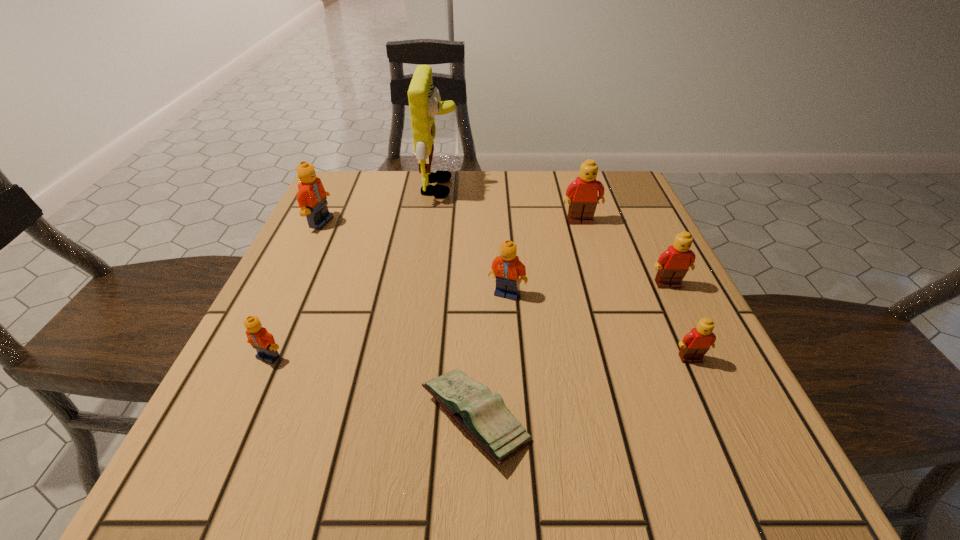
Where is `sponge positioned at the far edge`? The width and height of the screenshot is (960, 540). sponge positioned at the far edge is located at coordinates (425, 102).

The height and width of the screenshot is (540, 960). I want to click on object located at the near edge, so click(484, 416).

Find the location of `object at the far left corner`. object at the far left corner is located at coordinates (311, 197).

This screenshot has height=540, width=960. Find the location of `object at the far right corner`. object at the far right corner is located at coordinates (582, 193).

This screenshot has height=540, width=960. Find the location of `vacant area at the far edge`. vacant area at the far edge is located at coordinates (451, 171).

Locate an element on the screen. free region at the near edge of the desktop is located at coordinates (347, 483).

I want to click on vacant space at the left edge of the desktop, so click(320, 294).

Identify the location of free space at the right edge of the desktop. The width and height of the screenshot is (960, 540). (682, 291).

The image size is (960, 540). Find the location of `blank space at the near left corner of the desktop`. blank space at the near left corner of the desktop is located at coordinates (263, 470).

In the image, there is a desktop. Where is `vacant space at the far right corner`? The height and width of the screenshot is (540, 960). vacant space at the far right corner is located at coordinates (615, 178).